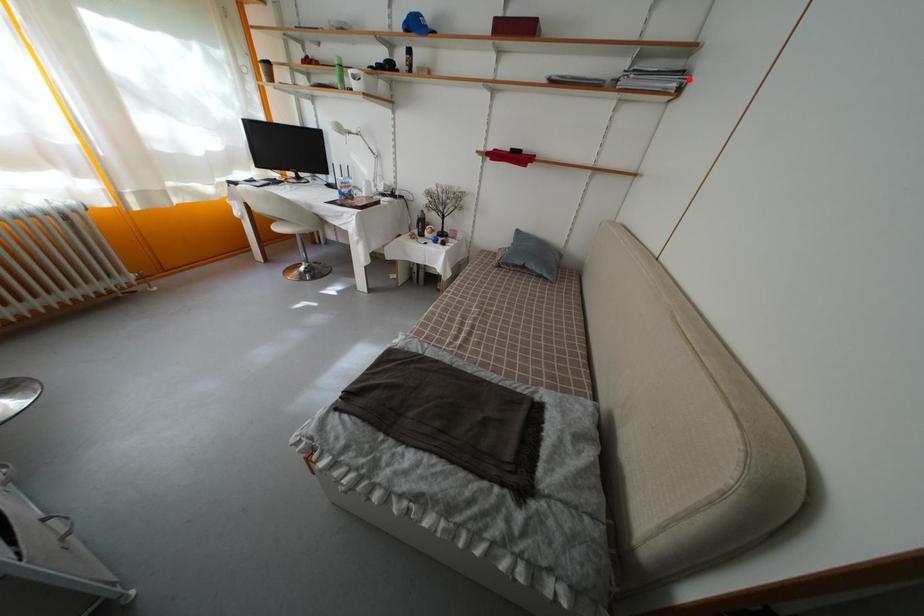
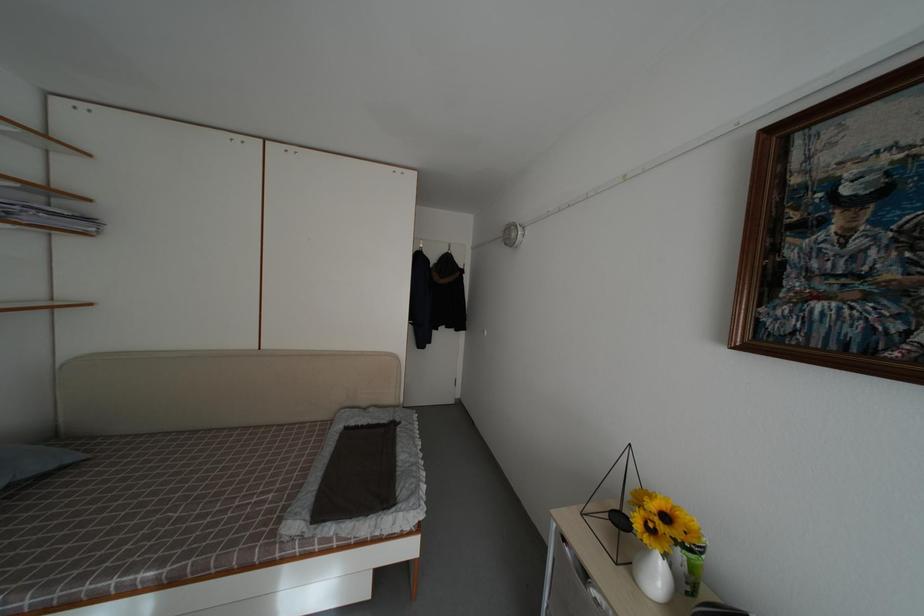
Find the pixel in the second image that matches the highlighted location in the first image.

(94, 225)